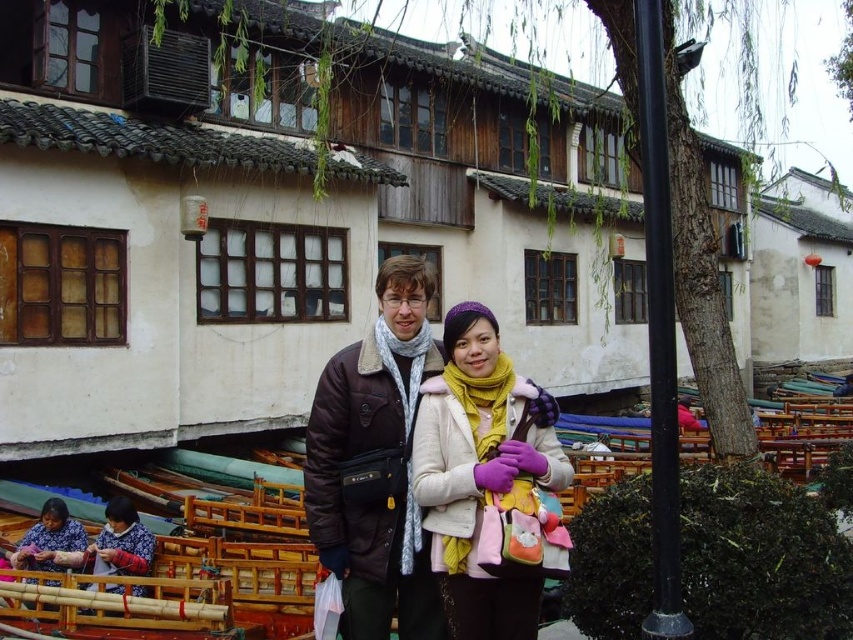
You are a photographer setting up equipment in the village. You need to position a wide camera lens between the matte white coat at center and the black metal pole at right. Which object should you place the lens closer to to ensure it fits within the space?

The matte white coat at center has a lesser width compared to the black metal pole at right, so you should place the lens closer to the matte white coat at center to accommodate its narrower space.

You are a photographer standing in front of the wooden boats along the canal. You want to take a photo that includes both the point at coordinates point (517, 451) and point (643, 58). Which point will appear closer to the camera in the photo?

Point (517, 451) will appear closer to the camera in the photo because it is further to the camera than point (643, 58).

You are a photographer trying to capture the two subjects in the scene. You notice the matte white coat at center and the matte purple scarf at lower left. Which object is located to the right of the other?

The matte white coat at center is positioned on the right side of the matte purple scarf at lower left.